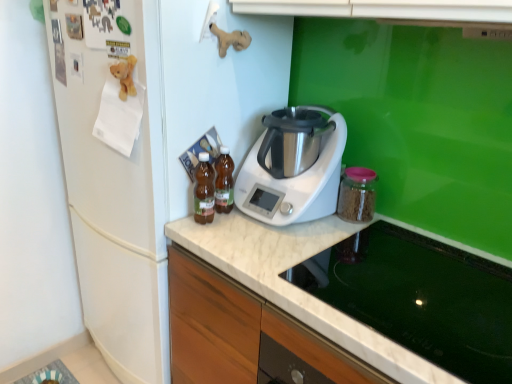
What are the coordinates of `spots to the right of brown glass bottles at center, arranged as the 4th kitchen appliance when viewed from the right` in the screenshot? It's located at (248, 230).